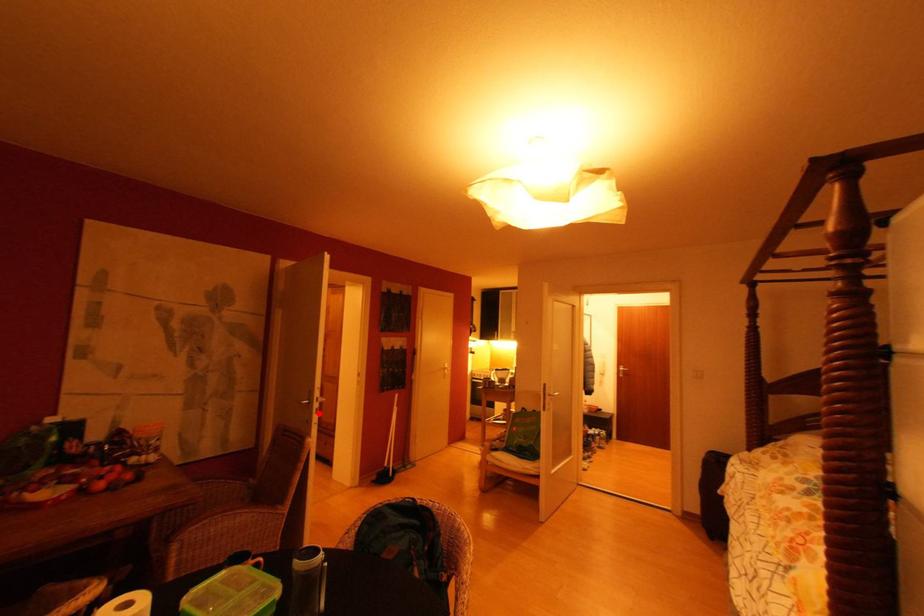
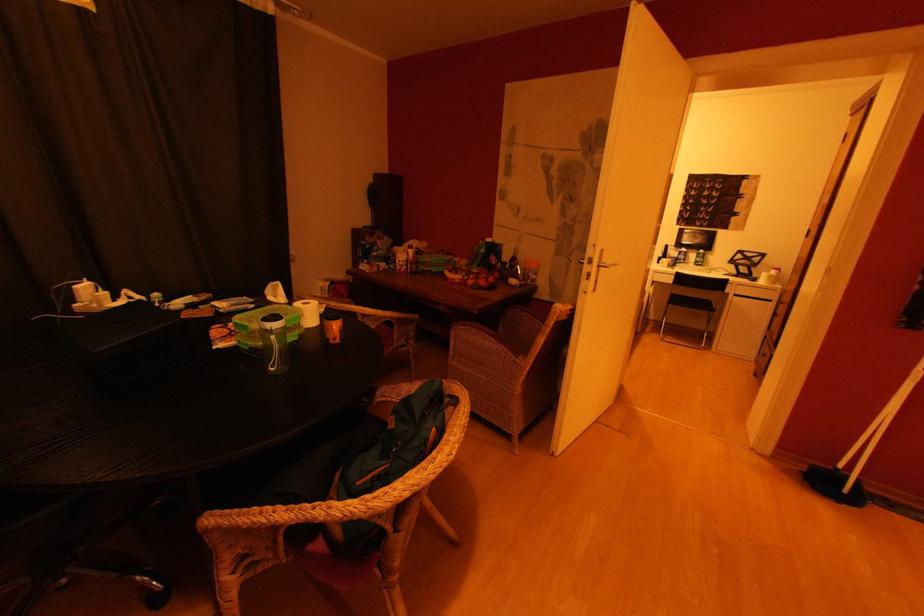
The point at the highlighted location is marked in the first image. Where is the corresponding point in the second image?

(590, 277)